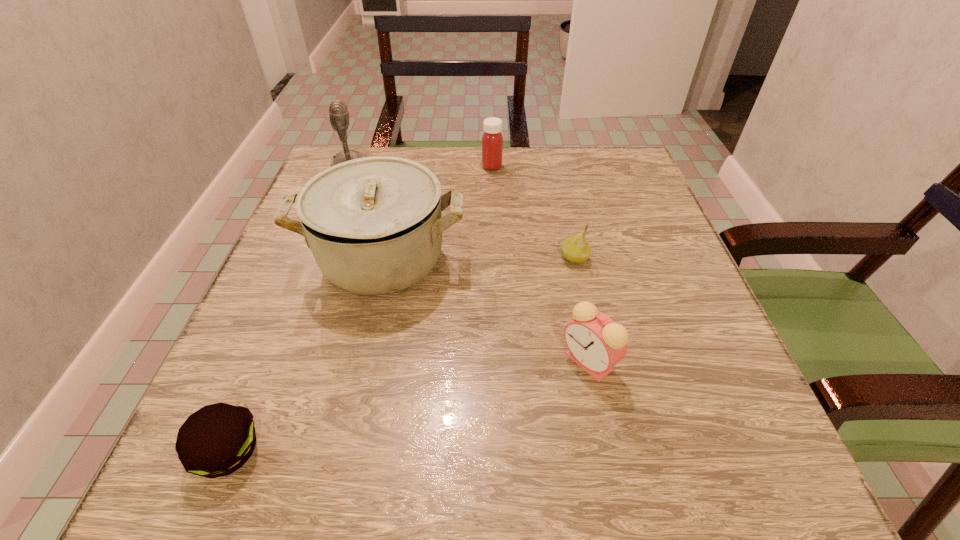
What are the coordinates of `patty present at the left edge` in the screenshot? It's located at (218, 439).

This screenshot has width=960, height=540. I want to click on object that is at the far left corner, so (x=338, y=111).

Identify the location of object that is positioned at the near left corner. The height and width of the screenshot is (540, 960). (218, 439).

In the image, there is a desktop. Identify the location of vacant space at the far edge. (488, 173).

You are a GUI agent. You are given a task and a screenshot of the screen. Output one action in this format:
    pyautogui.click(x=<x>, y=<y>)
    Task: Click on the free space at the near edge
    
    Given the screenshot: What is the action you would take?
    pyautogui.click(x=456, y=484)

In the image, there is a desktop. Identify the location of vacant space at the left edge. (337, 305).

The image size is (960, 540). In the image, there is a desktop. In order to click on vacant space at the right edge in this screenshot , I will do `click(648, 217)`.

This screenshot has width=960, height=540. What are the coordinates of `vacant space at the far right corner of the desktop` in the screenshot? It's located at (578, 147).

At what (x,y) coordinates should I click in order to perform the action: click on free space between the fifth tallest object and the patty. Please return your answer as a coordinate pair (x, y). Image resolution: width=960 pixels, height=540 pixels. Looking at the image, I should click on (401, 355).

Where is `vacant space that's between the pear and the nearest object`? The image size is (960, 540). vacant space that's between the pear and the nearest object is located at coordinates (401, 355).